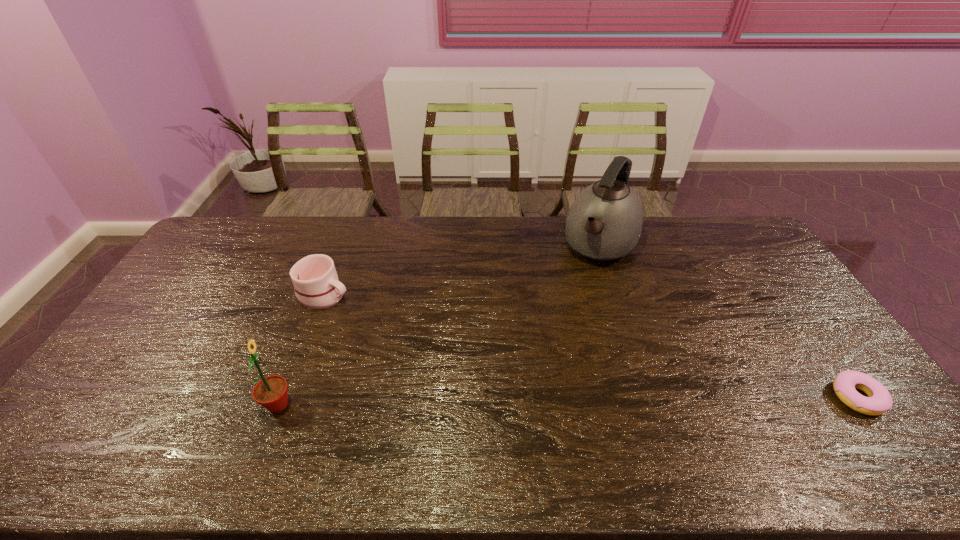
At what (x,y) coordinates should I click in order to perform the action: click on the second tallest object. Please return your answer as a coordinate pair (x, y). The height and width of the screenshot is (540, 960). Looking at the image, I should click on (271, 392).

I want to click on doughnut, so click(x=879, y=400).

Where is `the rightmost object`? The width and height of the screenshot is (960, 540). the rightmost object is located at coordinates (879, 400).

Find the location of `the third nearest object`. the third nearest object is located at coordinates (317, 286).

The height and width of the screenshot is (540, 960). In order to click on the third tallest object in this screenshot , I will do `click(317, 286)`.

Locate an element on the screen. This screenshot has height=540, width=960. the farthest object is located at coordinates (604, 223).

Where is `the third object from left to right`? The height and width of the screenshot is (540, 960). the third object from left to right is located at coordinates (604, 223).

The image size is (960, 540). Find the location of `vacant space situated on the face of the sunflower`. vacant space situated on the face of the sunflower is located at coordinates (413, 405).

At what (x,y) coordinates should I click in order to perform the action: click on vacant space situated 0.140m on the left of the shortest object. Please return your answer as a coordinate pair (x, y). The height and width of the screenshot is (540, 960). Looking at the image, I should click on (779, 397).

Where is `free region located on the side with the handle of the mug`? This screenshot has height=540, width=960. free region located on the side with the handle of the mug is located at coordinates (377, 316).